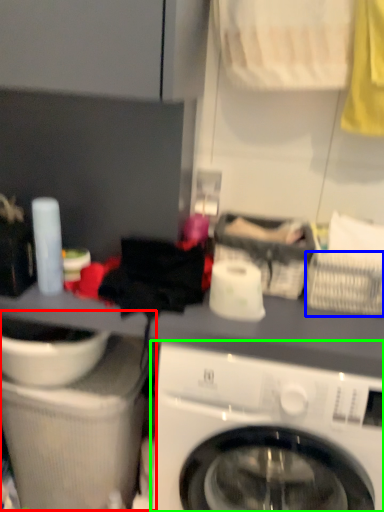
Question: Which is nearer to the sink (highlighted by a red box)? basket (highlighted by a blue box) or washing machine (highlighted by a green box).

Choices:
 (A) basket
 (B) washing machine

Answer: (B)